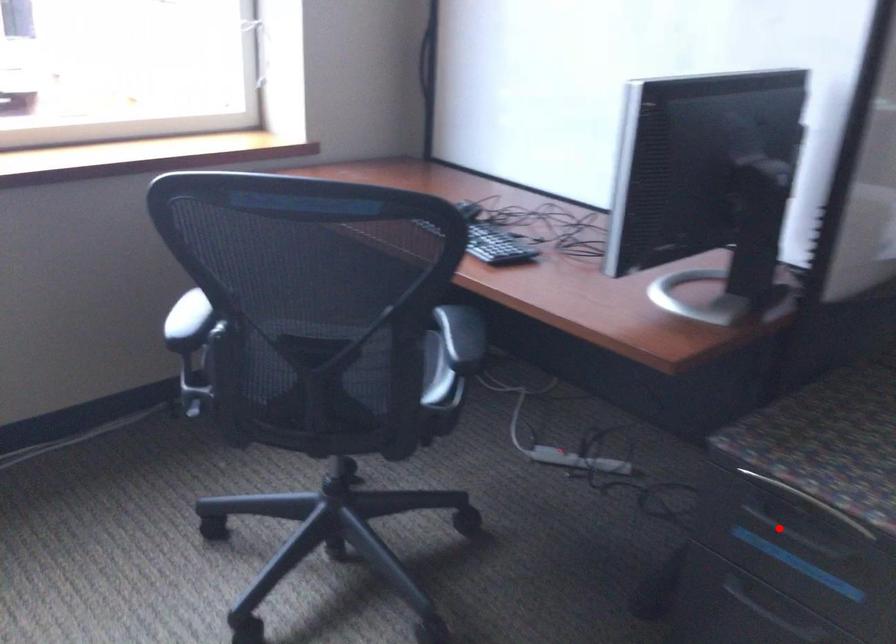
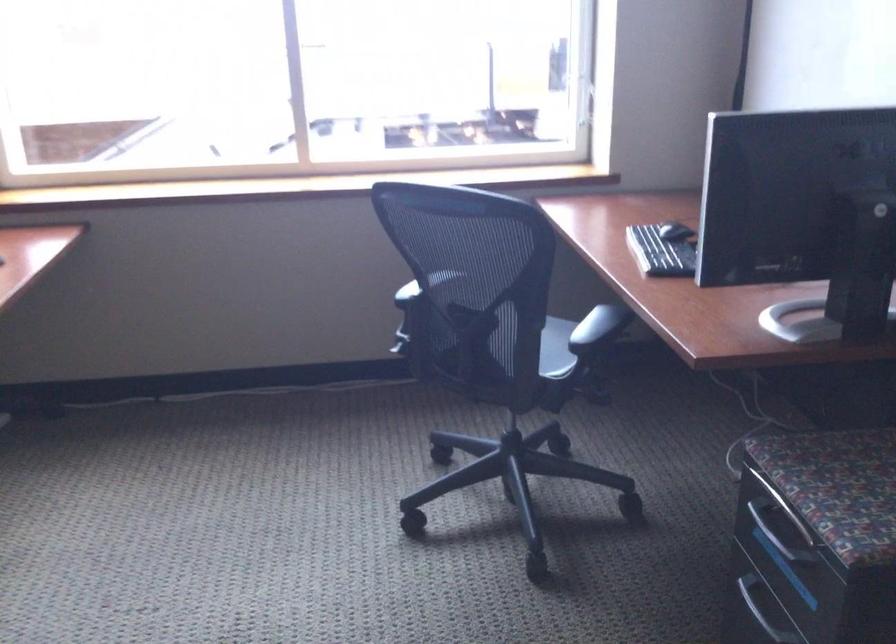
In the second image, find the point that corresponds to the highlighted location in the first image.

(776, 532)